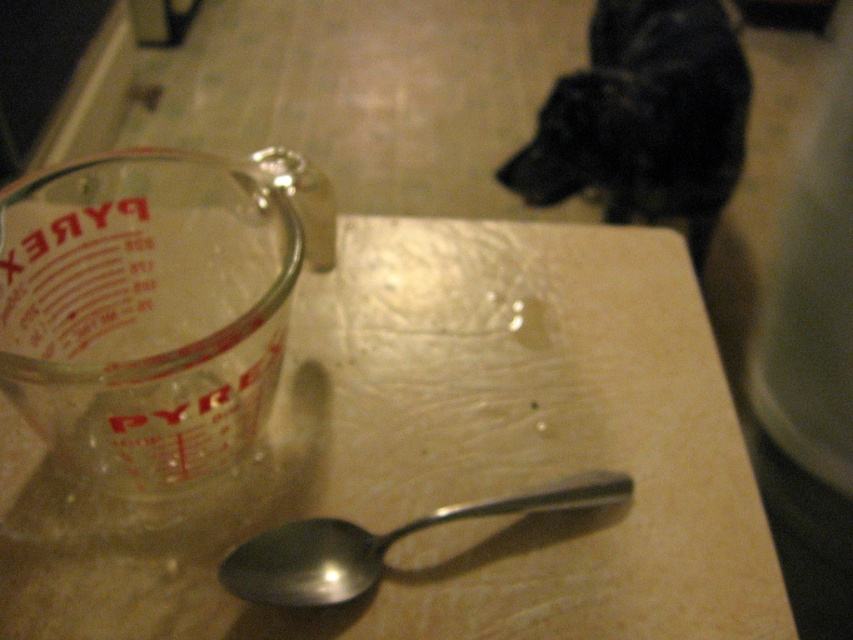
You are a chef preparing a recipe that requires precise measurements. You have a matte glass measuring cup at left and a black fur dog at upper right in your kitchen. If the dog moves 10 inches closer to the measuring cup, will it be within 30 inches of the cup?

The matte glass measuring cup at left is currently 37.79 inches away from the black fur dog at upper right. If the dog moves 10 inches closer, the distance between them would be 37.79 minus 10, which equals 27.79 inches. Since 27.79 is less than 30, the dog would be within 30 inches of the cup.

You are a photographer adjusting your camera settings to capture the scene. You notice two points in the image at coordinates point (317, 513) and point (254, 588). Which point should you focus on to ensure both points are in sharp focus?

To ensure both points are in sharp focus, focus on point (317, 513) because it is closer to the camera than point (254, 588). Focusing on the closer point will maximize the depth of field to include the farther point within the acceptable focus range.

You are trying to decide whether to place a new cookie cutter on the kitchen countertop. The cookie cutter is 12 centimeters wide. You see the matte glass measuring cup at left and the black fur dog at upper right. Which object can the cookie cutter fit next to without overlapping, based on their widths?

The cookie cutter is 12 centimeters wide. Since the matte glass measuring cup at left is narrower than the black fur dog at upper right, the cookie cutter can fit next to the matte glass measuring cup at left as it has sufficient space.